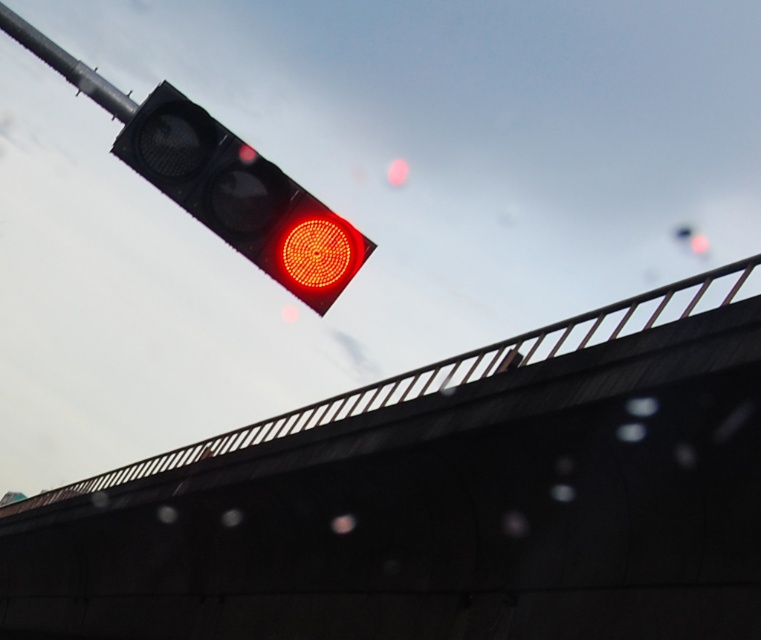
Is black metal overpass at upper center closer to camera compared to metallic pole at upper left?

That is False.

Who is shorter, black metal overpass at upper center or metallic pole at upper left?

metallic pole at upper left

Which is behind, point (81, 609) or point (116, 90)?

The point (81, 609) is more distant.

The height and width of the screenshot is (640, 761). In order to click on black metal overpass at upper center in this screenshot , I will do `click(441, 499)`.

Can you confirm if black metal overpass at upper center is thinner than matte black traffic light at upper center?

In fact, black metal overpass at upper center might be wider than matte black traffic light at upper center.

Is the position of black metal overpass at upper center more distant than that of matte black traffic light at upper center?

Yes, black metal overpass at upper center is further from the viewer.

Does point (205, 545) come farther from viewer compared to point (234, 166)?

That is True.

The height and width of the screenshot is (640, 761). In order to click on black metal overpass at upper center in this screenshot , I will do pyautogui.click(x=441, y=499).

Between matte black traffic light at upper center and metallic pole at upper left, which one appears on the left side from the viewer's perspective?

metallic pole at upper left

Does matte black traffic light at upper center have a greater height compared to metallic pole at upper left?

Yes.

I want to click on matte black traffic light at upper center, so click(240, 196).